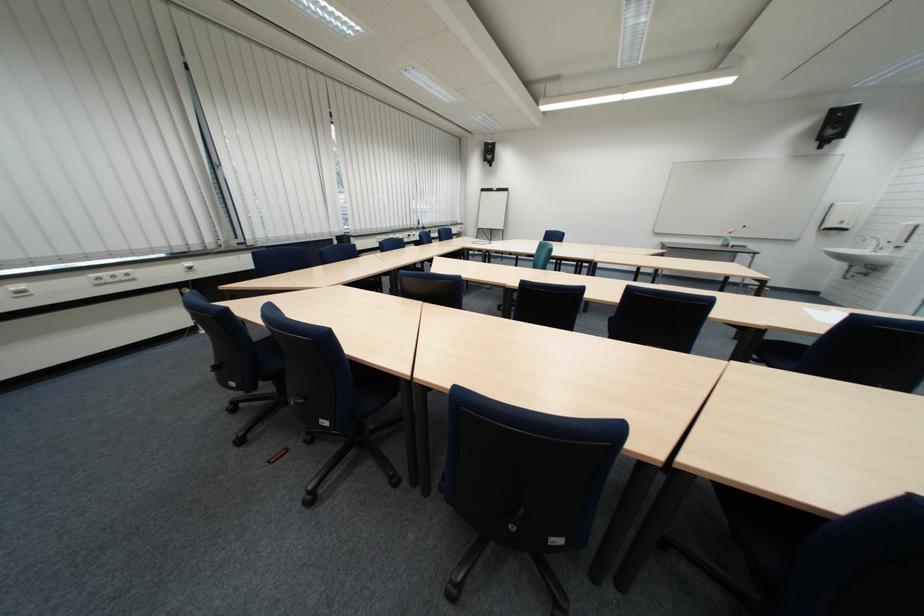
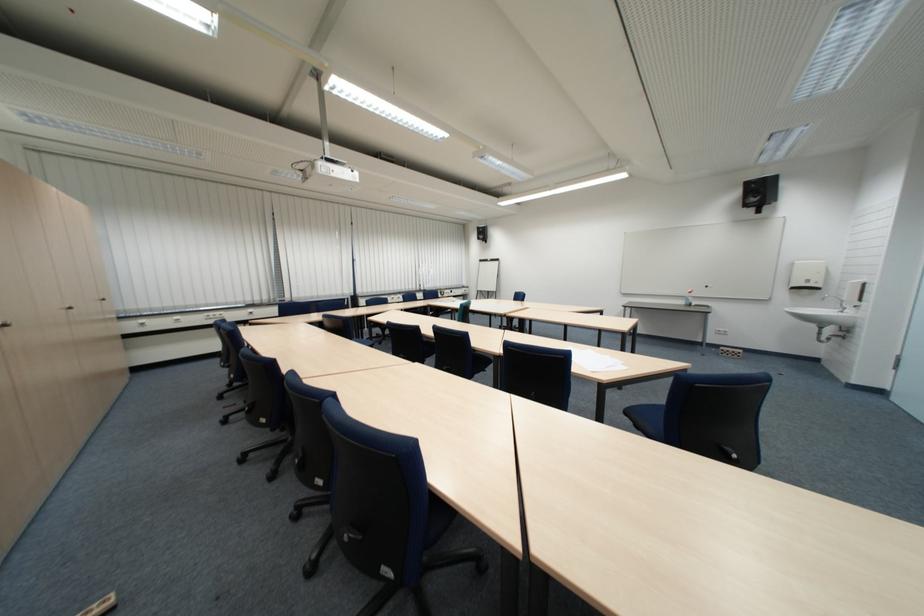
Where in the second image is the point corresponding to [840,230] from the first image?

(807, 290)